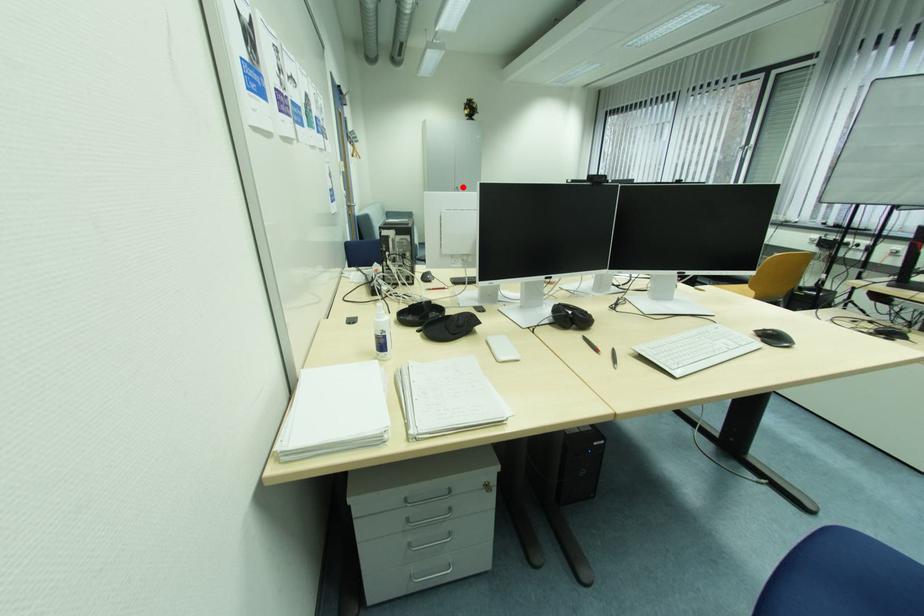
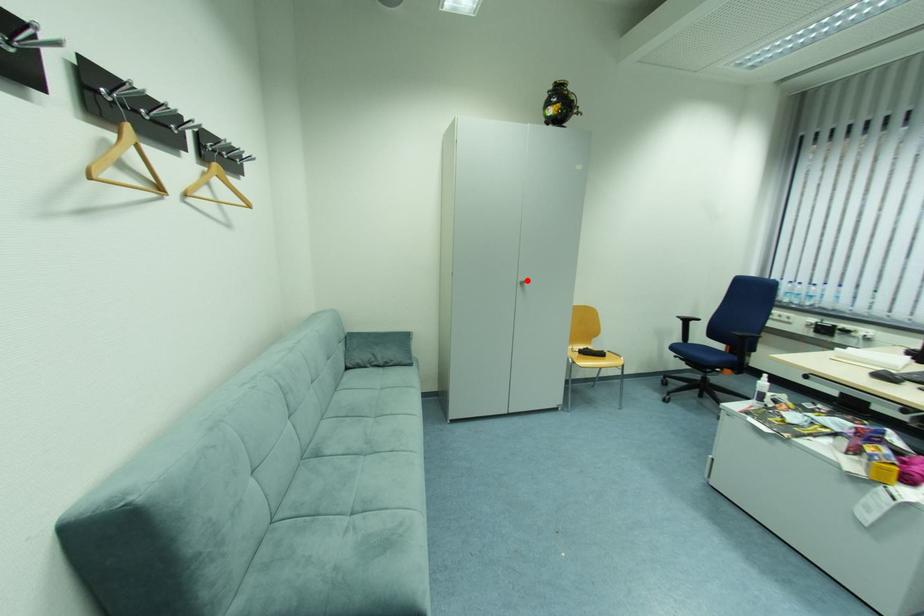
I am providing you with two images of the same scene from different viewpoints. A red point is marked on the first image and another point is marked on the second image. Does the point marked in image1 correspond to the same location as the one in image2?

Yes